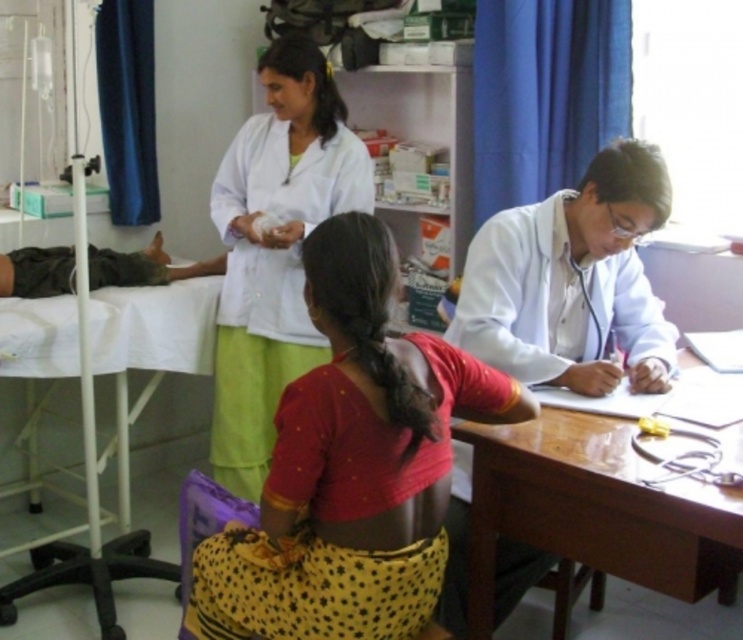
From the picture: Between red cotton saree at center and wooden table at center, which one has more height?

With more height is red cotton saree at center.

Does point (400, 499) come in front of point (684, 577)?

Yes, point (400, 499) is in front of point (684, 577).

Locate an element on the screen. The image size is (743, 640). red cotton saree at center is located at coordinates (351, 467).

Is white smooth coat at upper center smaller than wooden table at center?

No.

Describe the element at coordinates (275, 250) in the screenshot. I see `white smooth coat at upper center` at that location.

Is point (360, 154) closer to viewer compared to point (691, 356)?

That is False.

This screenshot has width=743, height=640. What are the coordinates of `white smooth coat at upper center` in the screenshot? It's located at (275, 250).

Can you confirm if white glossy coat at center is positioned above dark green fabric leg at left?

Actually, white glossy coat at center is below dark green fabric leg at left.

Does white glossy coat at center come in front of dark green fabric leg at left?

Yes, it is in front of dark green fabric leg at left.

Identify the location of white glossy coat at center. (571, 282).

Locate an element on the screen. The width and height of the screenshot is (743, 640). white glossy coat at center is located at coordinates (571, 282).